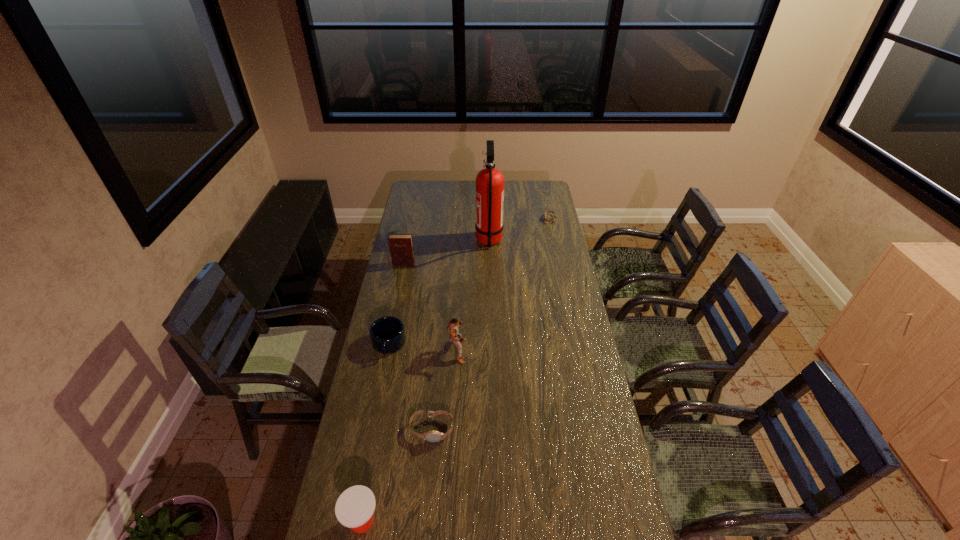
Locate an element on the screen. free space located 0.300m on the face of the shortest object is located at coordinates (492, 219).

I want to click on free region located on the face of the shortest object, so click(494, 219).

Where is `vacant space located 0.160m on the face of the shortest object`? vacant space located 0.160m on the face of the shortest object is located at coordinates (516, 219).

Find the location of a particular element. This screenshot has width=960, height=540. free space located 0.230m on the handle side of the fire extinguisher is located at coordinates (432, 241).

Where is `vacant space located on the handle side of the fire extinguisher`? vacant space located on the handle side of the fire extinguisher is located at coordinates (436, 241).

Find the location of a particular element. This screenshot has width=960, height=540. vacant space located on the handle side of the fire extinguisher is located at coordinates (420, 241).

The width and height of the screenshot is (960, 540). Identify the location of free space located on the front cover of the diary. (398, 287).

Find the location of a particular element. Image resolution: width=960 pixels, height=540 pixels. vacant position located with the handle on the side of the third shortest object is located at coordinates (383, 371).

This screenshot has width=960, height=540. Identify the location of free region located 0.360m on the front-facing side of the puncher. (555, 351).

The image size is (960, 540). I want to click on diary that is positioned at the left edge, so click(x=401, y=245).